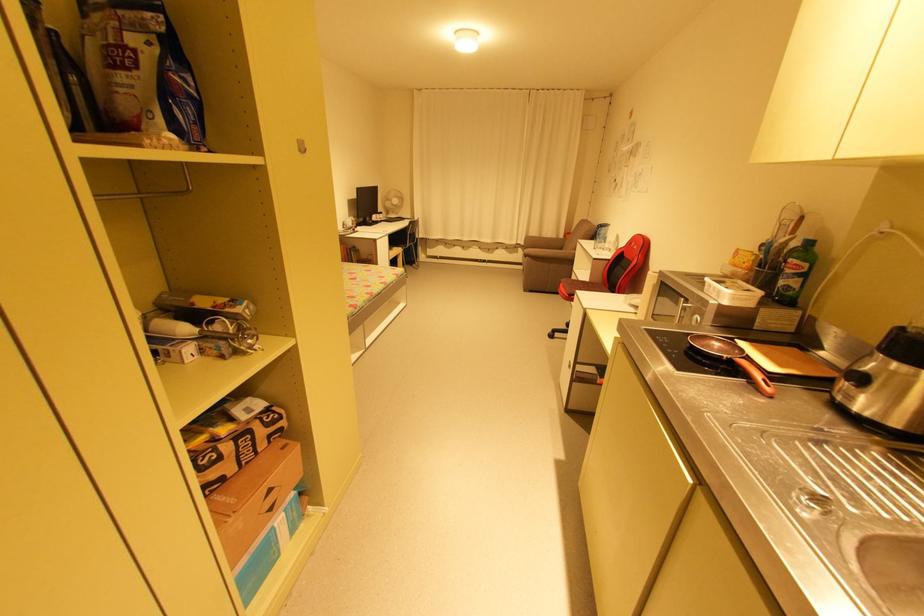
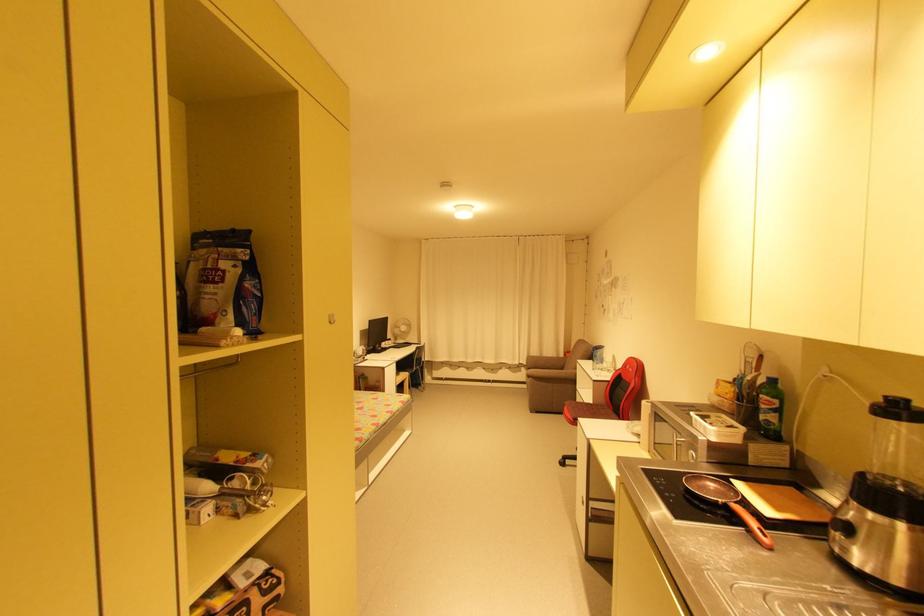
The point at (637,245) is marked in the first image. Where is the corresponding point in the second image?

(631, 367)